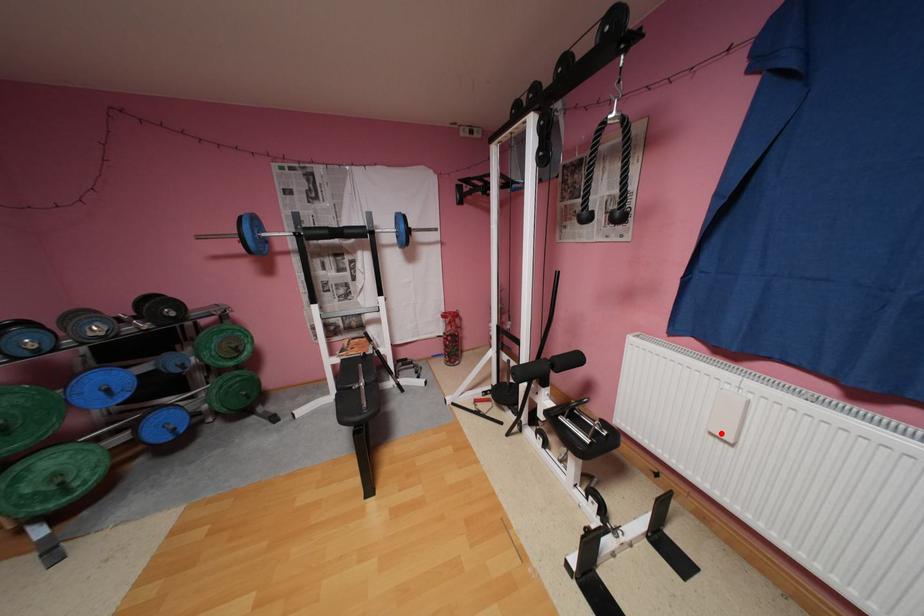
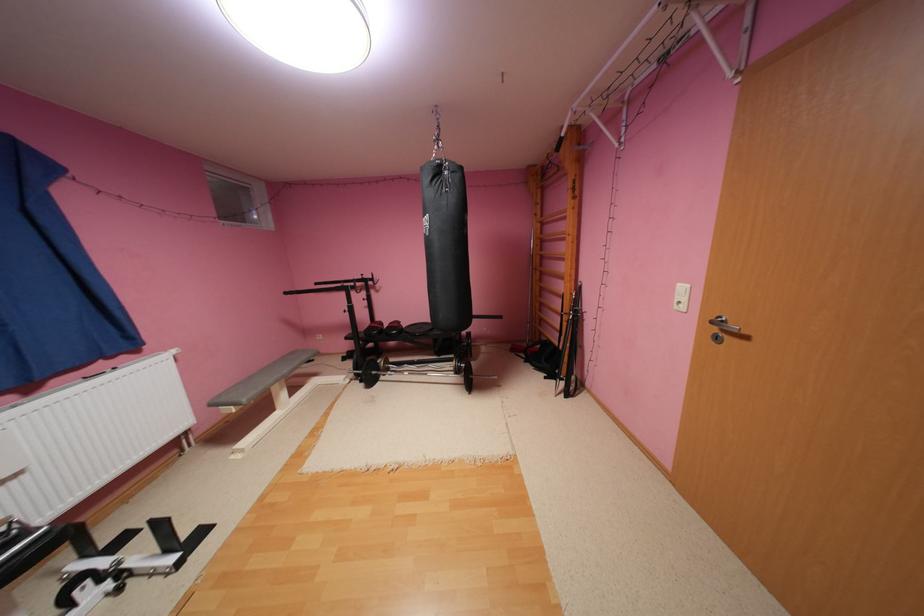
Question: A red point is marked in image1. In image2, is the corresponding 3D point closer to the camera or farther? Reply with the corresponding letter.

Choices:
 (A) The corresponding 3D point is closer.
 (B) The corresponding 3D point is farther.

Answer: (B)